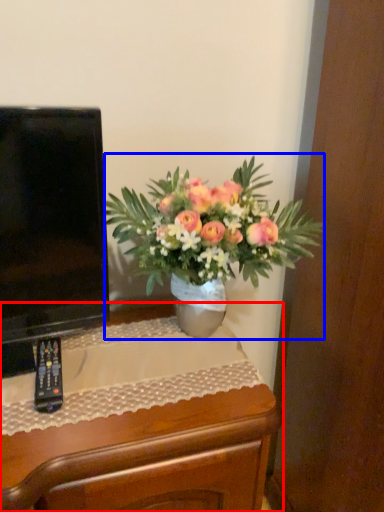
Question: Which of the following is the farthest to the observer, desk (highlighted by a red box) or houseplant (highlighted by a blue box)?

Choices:
 (A) desk
 (B) houseplant

Answer: (A)